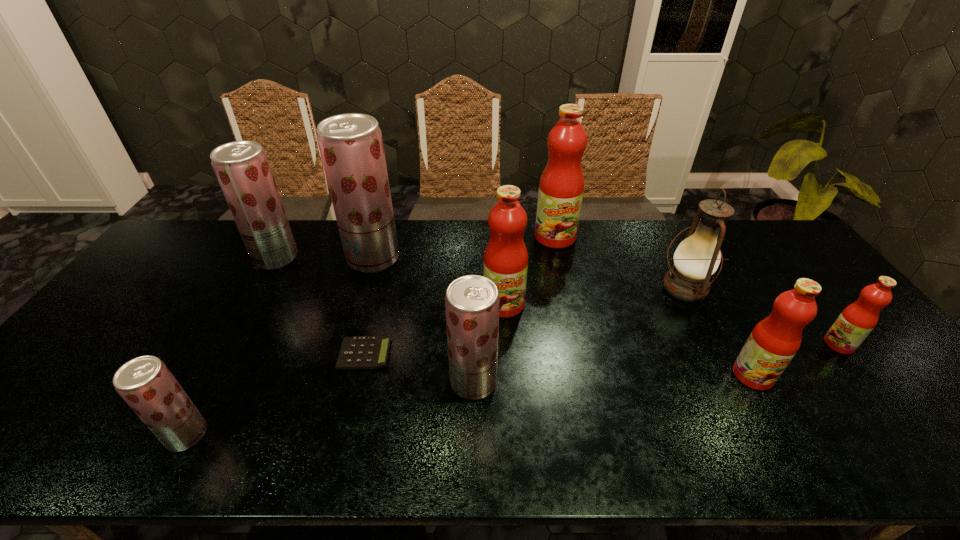
Where is `vacant space located 0.380m on the front label of the third nearest pink fruit juice`? This screenshot has height=540, width=960. vacant space located 0.380m on the front label of the third nearest pink fruit juice is located at coordinates (513, 447).

What are the coordinates of `vacant space positioned 0.240m on the right of the oil lamp` in the screenshot? It's located at (791, 288).

Where is `vacant area situated 0.120m on the front label of the second fruit juice from right to left`? vacant area situated 0.120m on the front label of the second fruit juice from right to left is located at coordinates (788, 438).

Identify the location of vacant space located on the back of the second smallest strawberry fruit juice. (474, 339).

Where is `free location located 0.260m on the front label of the smallest pink fruit juice`? The height and width of the screenshot is (540, 960). free location located 0.260m on the front label of the smallest pink fruit juice is located at coordinates (727, 345).

The height and width of the screenshot is (540, 960). What are the coordinates of `vacant space situated on the front label of the smallest pink fruit juice` in the screenshot? It's located at (734, 345).

Find the location of a particular element. Image resolution: width=960 pixels, height=540 pixels. vacant space located on the front label of the smallest pink fruit juice is located at coordinates (768, 345).

Find the location of a particular element. free space located on the right of the nearest fruit juice is located at coordinates (356, 435).

I want to click on free point located 0.390m on the left of the shortest object, so click(x=190, y=354).

This screenshot has width=960, height=540. What are the coordinates of `object present at the near edge` in the screenshot? It's located at (146, 384).